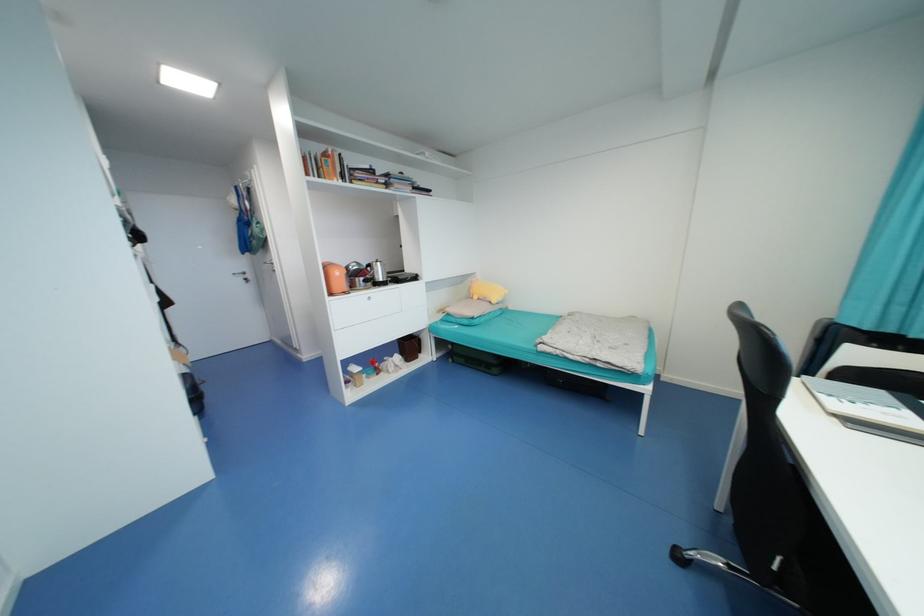
This screenshot has width=924, height=616. What do you see at coordinates (378, 273) in the screenshot?
I see `a silver electric kettle` at bounding box center [378, 273].